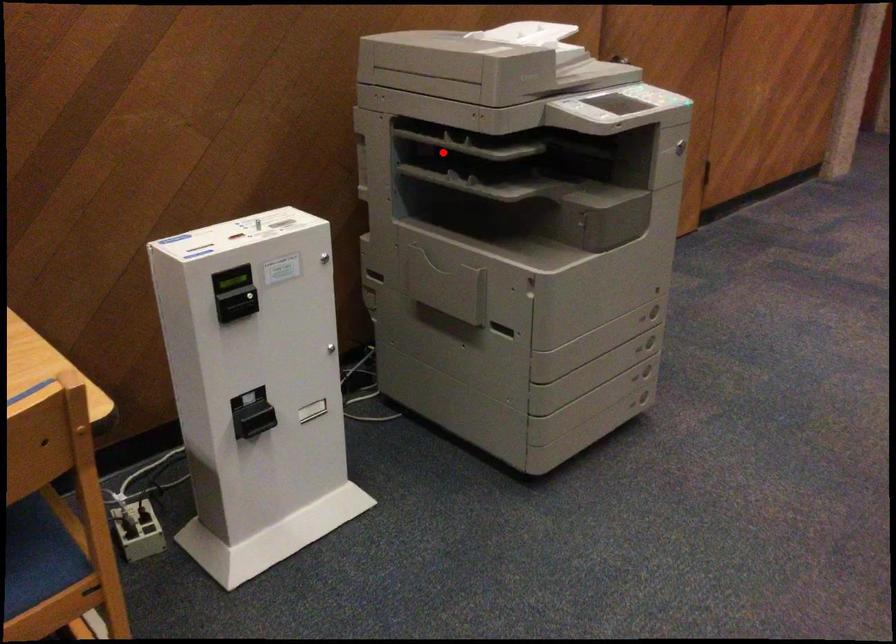
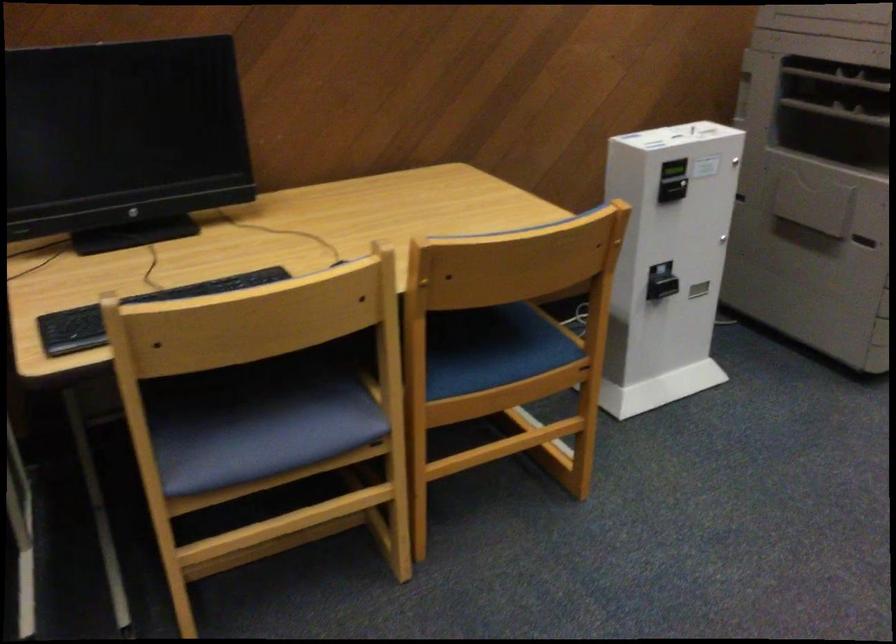
Question: I am providing you with two images of the same scene from different viewpoints. A red point is marked on the first image. At the location where the point appears in image 1, is it still visible in image 2?

Choices:
 (A) Yes
 (B) No

Answer: (A)